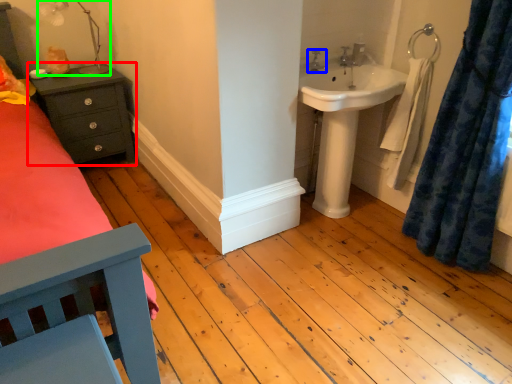
Question: Which object is the closest to the nightstand (highlighted by a red box)? Choose among these: tap (highlighted by a blue box) or lamp (highlighted by a green box).

Choices:
 (A) tap
 (B) lamp

Answer: (B)